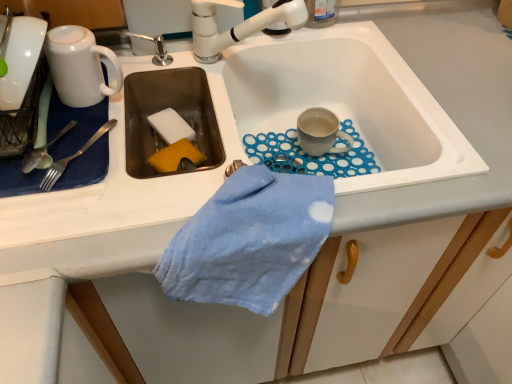
You are a GUI agent. You are given a task and a screenshot of the screen. Output one action in this format:
    pyautogui.click(x=<x>, y=<y>)
    Task: Click on the free location to the right of satin silver spoon at left, the second silverware positioned from the left
    The width and height of the screenshot is (512, 384).
    Given the screenshot: What is the action you would take?
    pyautogui.click(x=154, y=174)